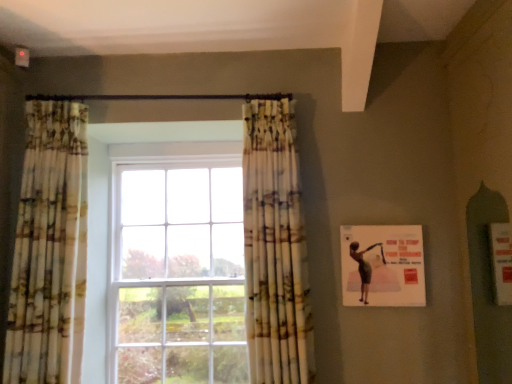
Question: From a real-world perspective, relative to printed fabric curtain at left, the 1th curtain positioned from the left, is printed fabric curtain at center, the second curtain in the left-to-right sequence, vertically above or below?

Choices:
 (A) above
 (B) below

Answer: (B)

Question: Based on their positions, is printed fabric curtain at center, which is the 1th curtain in right-to-left order, located to the left or right of printed fabric curtain at left, the 1th curtain positioned from the left?

Choices:
 (A) left
 (B) right

Answer: (B)

Question: Which of these objects is positioned farthest from the matte pink poster at right?

Choices:
 (A) printed fabric curtain at left, the 1th curtain positioned from the left
 (B) printed fabric curtain at center, which is the 1th curtain in right-to-left order

Answer: (A)

Question: Considering the real-world distances, which object is farthest from the printed fabric curtain at left, positioned as the second curtain in right-to-left order?

Choices:
 (A) printed fabric curtain at center, which is the 1th curtain in right-to-left order
 (B) matte pink poster at right

Answer: (B)